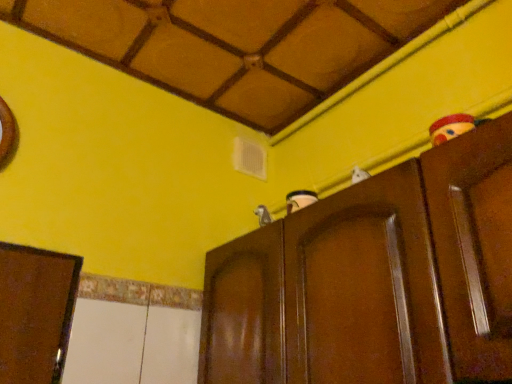
Question: Does brown wooden cupboard at upper center appear on the right side of brown glossy door at upper right?

Choices:
 (A) no
 (B) yes

Answer: (A)

Question: Can you confirm if brown wooden cupboard at upper center is taller than brown glossy door at upper right?

Choices:
 (A) no
 (B) yes

Answer: (B)

Question: Is brown wooden cupboard at upper center positioned with its back to brown glossy door at upper right?

Choices:
 (A) yes
 (B) no

Answer: (B)

Question: Does brown wooden cupboard at upper center turn towards brown glossy door at upper right?

Choices:
 (A) no
 (B) yes

Answer: (A)

Question: From a real-world perspective, is brown wooden cupboard at upper center positioned over brown glossy door at upper right based on gravity?

Choices:
 (A) yes
 (B) no

Answer: (B)

Question: Can you confirm if brown wooden cupboard at upper center is positioned to the left of brown glossy door at upper right?

Choices:
 (A) yes
 (B) no

Answer: (A)

Question: Could you tell me if brown glossy door at upper right is turned towards brown wooden cupboard at upper center?

Choices:
 (A) yes
 (B) no

Answer: (B)

Question: From a real-world perspective, is brown glossy door at upper right under brown wooden cupboard at upper center?

Choices:
 (A) no
 (B) yes

Answer: (A)

Question: Does brown glossy door at upper right lie in front of brown wooden cupboard at upper center?

Choices:
 (A) no
 (B) yes

Answer: (B)

Question: Considering the relative sizes of brown glossy door at upper right and brown wooden cupboard at upper center in the image provided, is brown glossy door at upper right thinner than brown wooden cupboard at upper center?

Choices:
 (A) no
 (B) yes

Answer: (B)

Question: Considering the relative positions of brown glossy door at upper right and brown wooden cupboard at upper center in the image provided, is brown glossy door at upper right behind brown wooden cupboard at upper center?

Choices:
 (A) yes
 (B) no

Answer: (B)

Question: From the image's perspective, is brown glossy door at upper right on brown wooden cupboard at upper center?

Choices:
 (A) no
 (B) yes

Answer: (B)

Question: From the image's perspective, is brown glossy door at upper right positioned above or below brown wooden cupboard at upper center?

Choices:
 (A) above
 (B) below

Answer: (A)